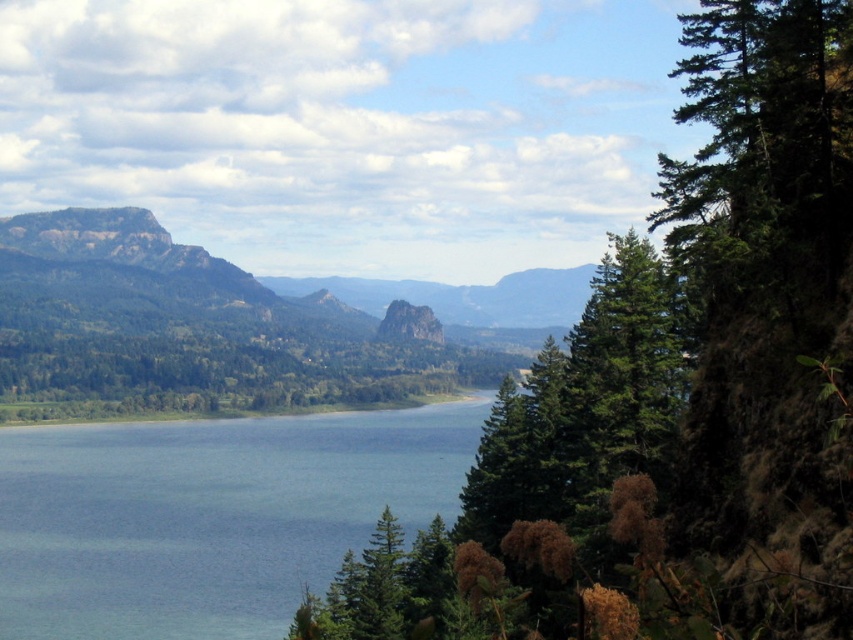
You are standing on the bank of the lake and want to take a photo of both the green textured tree at right and the blue water at center. Which object should you frame first to ensure both are in the shot?

The green textured tree at right is positioned on the right side of blue water at center, so you should frame the blue water at center first to ensure both are in the shot.

You are planning to take a photo of the green textured tree at right and the blue water at center. Which object should you zoom in on to capture more details without moving your camera?

The green textured tree at right has a smaller width than the blue water at center, so you should zoom in on the green textured tree at right to capture more details without moving your camera.